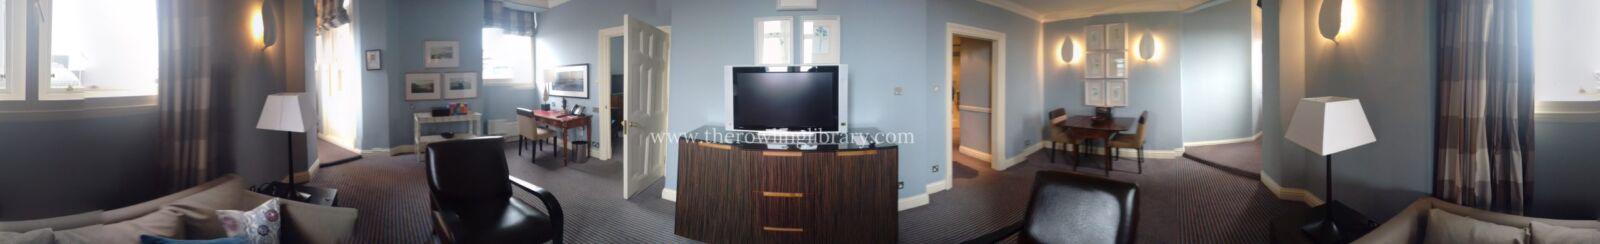
Where is `carpeted floor`? carpeted floor is located at coordinates (1195, 195), (579, 221), (373, 179).